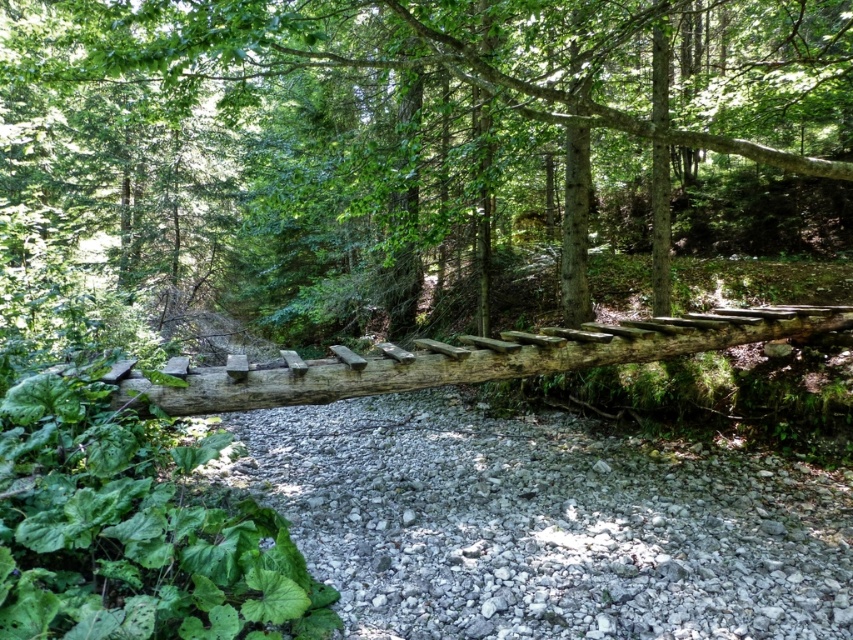
Question: Which of the following is the closest to the observer?

Choices:
 (A) (738, 10)
 (B) (659, 570)

Answer: (B)

Question: Is smooth brown log at center smaller than gray gravel at center?

Choices:
 (A) no
 (B) yes

Answer: (A)

Question: Is smooth brown log at center closer to camera compared to gray gravel at center?

Choices:
 (A) yes
 (B) no

Answer: (A)

Question: Does smooth brown log at center lie in front of gray gravel at center?

Choices:
 (A) no
 (B) yes

Answer: (B)